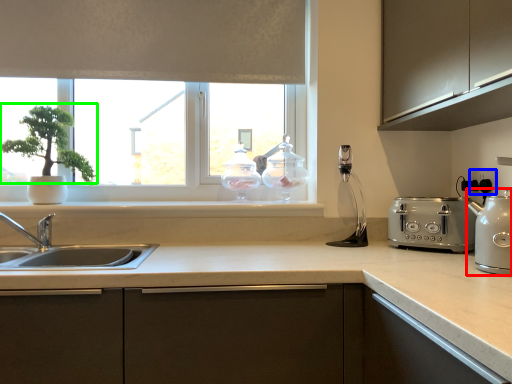
Question: Considering the real-world distances, which object is farthest from kitchen appliance (highlighted by a red box)? electric outlet (highlighted by a blue box) or plant (highlighted by a green box)?

Choices:
 (A) electric outlet
 (B) plant

Answer: (B)